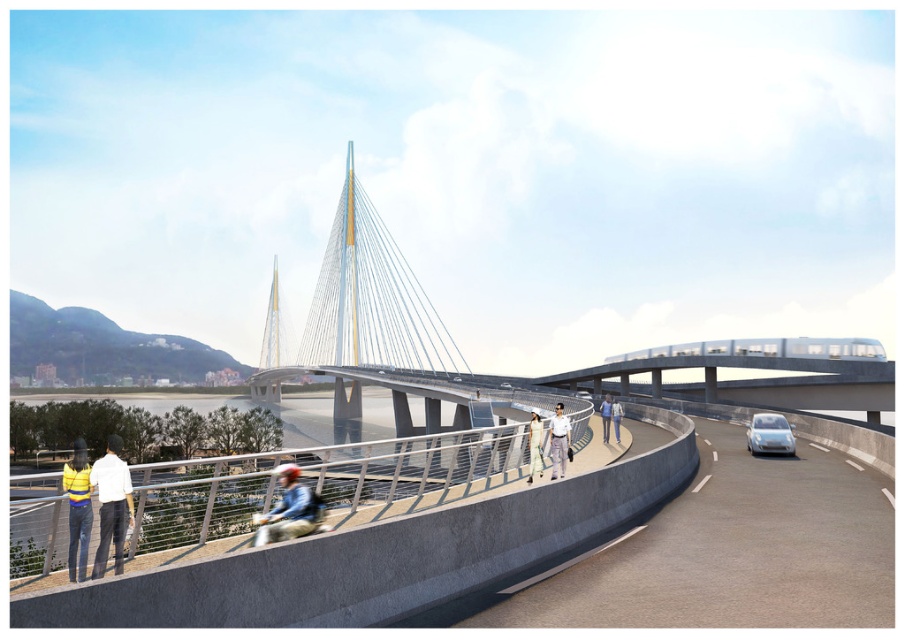
You are standing on the pedestrian walkway and notice a person wearing a denim jacket at center and light blue jeans at center. Which piece of clothing is closer to you?

The denim jacket at center is closer to you because it is further to the viewer than the light blue jeans at center.

You are standing at the base of the bridge and want to take a photo of the person wearing the light beige fabric dress at center and the person wearing the light blue jeans at center. How far apart are these two individuals?

The light beige fabric dress at center is 44.16 feet away from the light blue jeans at center, so the two individuals are 44.16 feet apart.